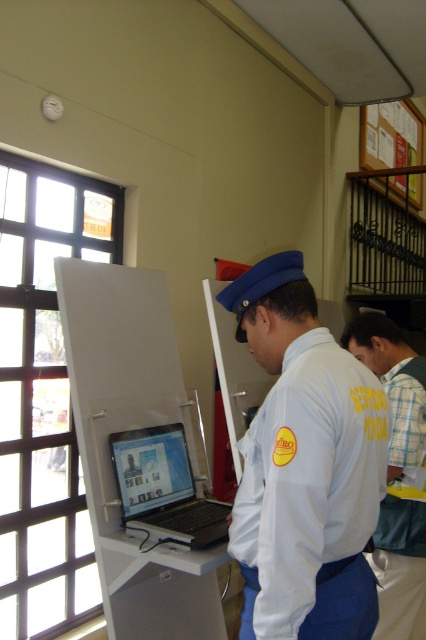
From the picture: Does white plastic laptop at left come in front of yellow fabric shirt at upper right?

Yes.

Who is taller, white plastic laptop at left or yellow fabric shirt at upper right?

white plastic laptop at left

From the picture: Who is more distant from viewer, (221, 621) or (425, 593)?

Point (221, 621)

In order to click on white plastic laptop at left in this screenshot , I will do `click(132, 429)`.

Based on the photo, which is below, light blue fabric uniform at center or black plastic laptop at center?

black plastic laptop at center

Between light blue fabric uniform at center and black plastic laptop at center, which one is positioned higher?

light blue fabric uniform at center

Where is `light blue fabric uniform at center`? light blue fabric uniform at center is located at coordinates (310, 493).

Who is taller, white plastic laptop at left or black plastic laptop at center?

With more height is white plastic laptop at left.

Is white plastic laptop at left in front of black plastic laptop at center?

Yes.

Is point (134, 358) behind point (158, 541)?

Yes.

Identify the location of white plastic laptop at left. This screenshot has height=640, width=426. (132, 429).